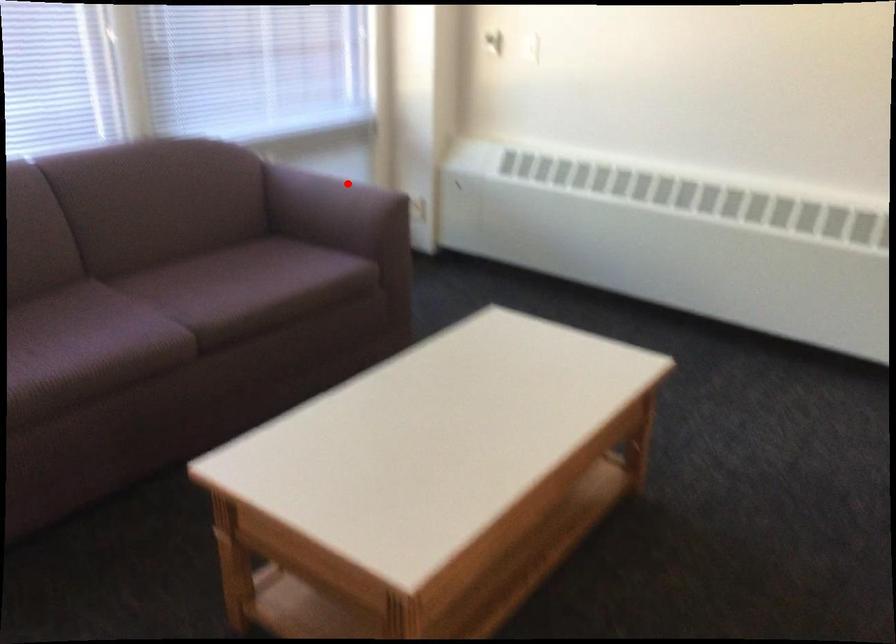
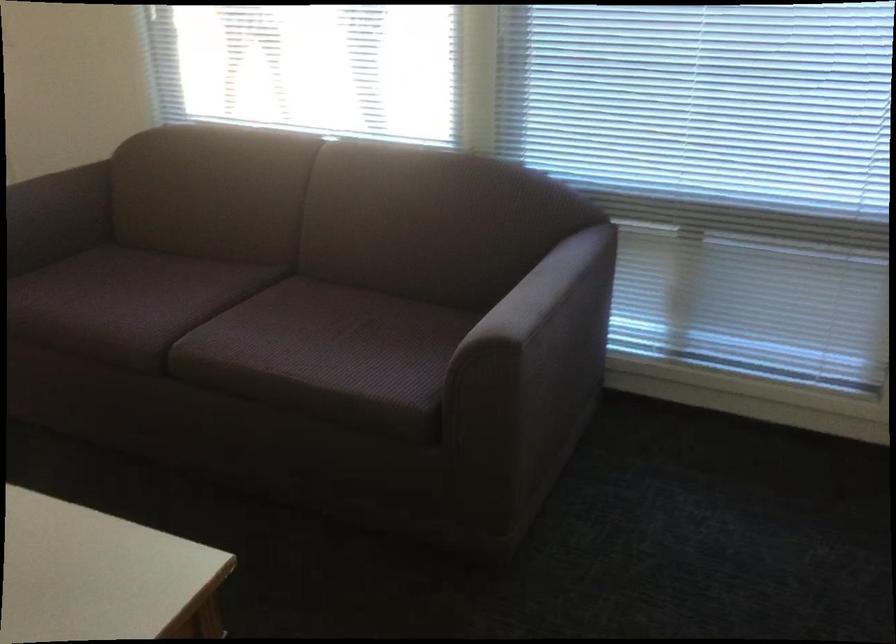
Question: I am providing you with two images of the same scene from different viewpoints. A red point is shown in image1. For the corresponding object point in image2, is it positioned nearer or farther from the camera?

Choices:
 (A) Nearer
 (B) Farther

Answer: (A)